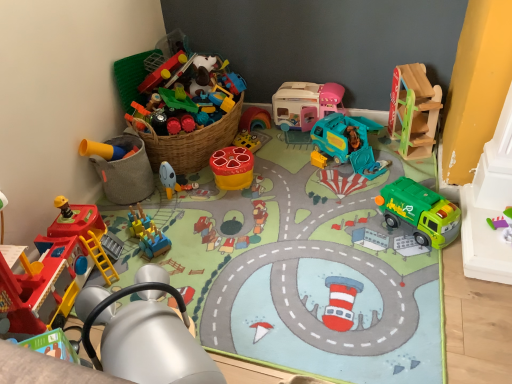
You are a GUI agent. You are given a task and a screenshot of the screen. Output one action in this format:
    pyautogui.click(x=<x>, y=<y>)
    Task: Click on the free point to the left of green plastic garbage truck at lower right, which is the 8th toy in left-to-right order
    This screenshot has height=384, width=512.
    Given the screenshot: What is the action you would take?
    pyautogui.click(x=366, y=233)